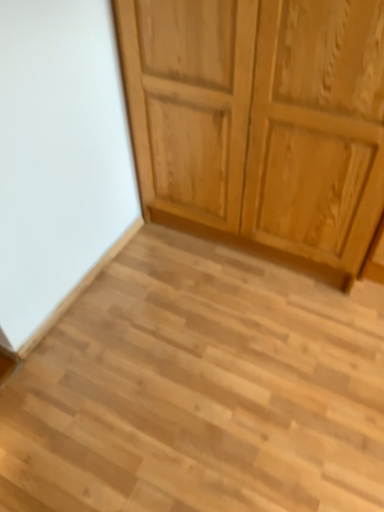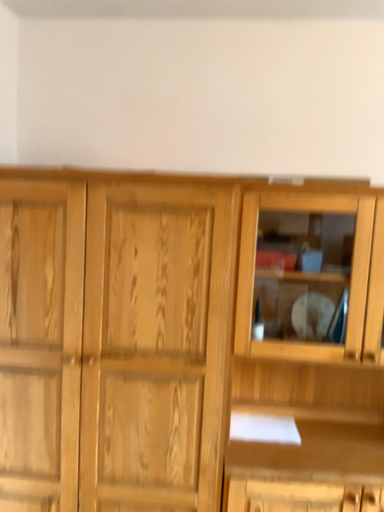
Question: How did the camera likely rotate when shooting the video?

Choices:
 (A) rotated downward
 (B) rotated upward

Answer: (B)